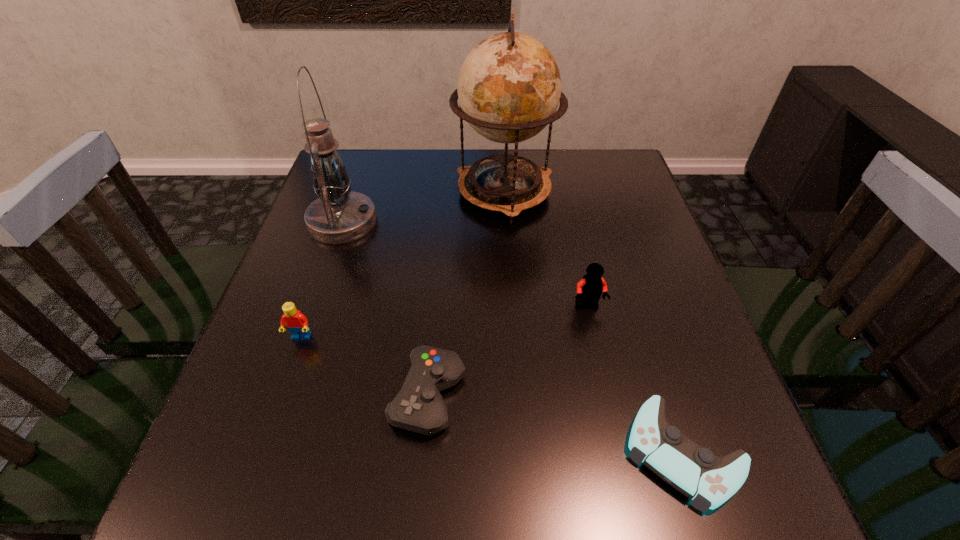
In order to click on globe in this screenshot , I will do `click(509, 87)`.

Identify the location of oil lamp. This screenshot has width=960, height=540. (339, 215).

The image size is (960, 540). I want to click on the fourth shortest object, so click(590, 287).

You are a GUI agent. You are given a task and a screenshot of the screen. Output one action in this format:
    pyautogui.click(x=<x>, y=<y>)
    Task: Click on the fourth nearest object
    
    Given the screenshot: What is the action you would take?
    pyautogui.click(x=590, y=287)

The width and height of the screenshot is (960, 540). Identify the location of the fourth farthest object. (297, 324).

Find the location of a particular element. the third shortest object is located at coordinates (297, 324).

Where is `the left control`? The height and width of the screenshot is (540, 960). the left control is located at coordinates (419, 407).

The height and width of the screenshot is (540, 960). Identify the location of the second shortest object. (419, 407).

Locate an element on the screen. Image resolution: width=960 pixels, height=540 pixels. the shorter control is located at coordinates (709, 480).

I want to click on the right control, so click(x=709, y=480).